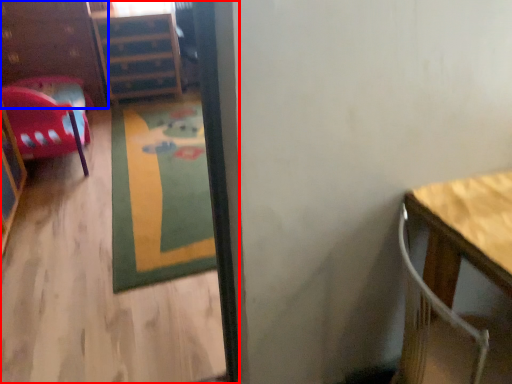
Question: Among these objects, which one is farthest to the camera, corridor (highlighted by a red box) or dresser (highlighted by a blue box)?

Choices:
 (A) corridor
 (B) dresser

Answer: (B)